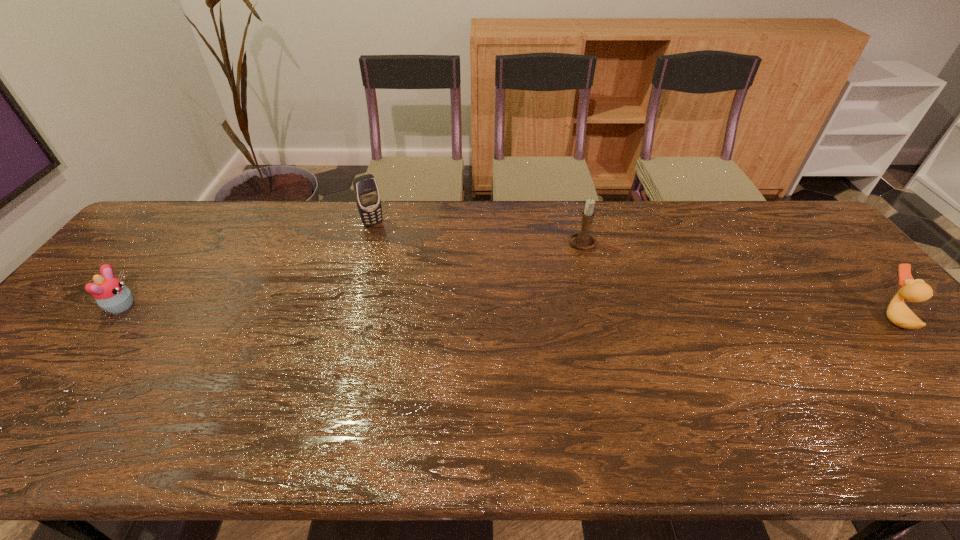
Where is `vacant spot on the desktop that is between the cupcake and the rightmost object and is positioned on the side of the third object from left to right with the handle`? The height and width of the screenshot is (540, 960). vacant spot on the desktop that is between the cupcake and the rightmost object and is positioned on the side of the third object from left to right with the handle is located at coordinates (454, 311).

Locate an element on the screen. vacant spot on the desktop that is between the leftmost object and the rightmost object and is positioned on the front face of the cellular telephone is located at coordinates (437, 310).